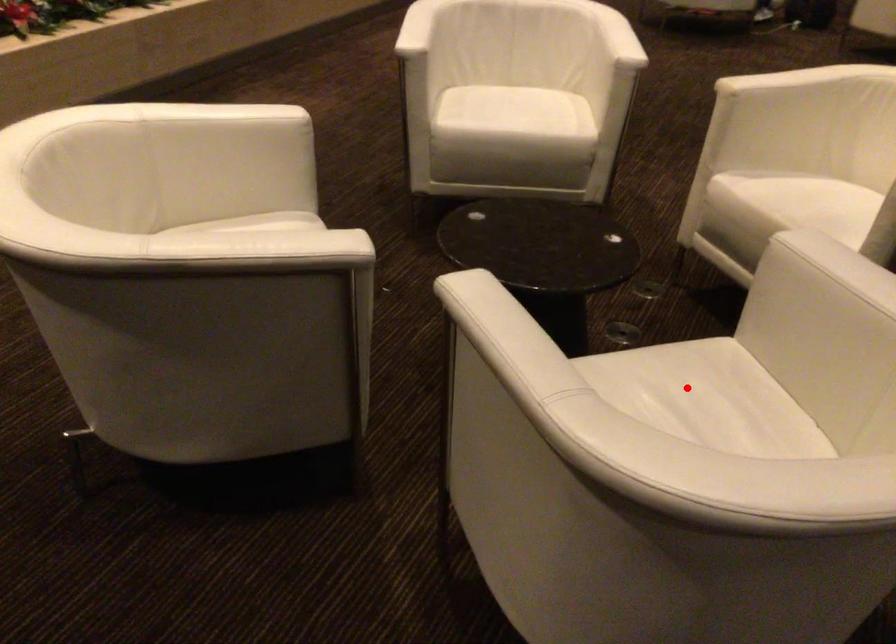
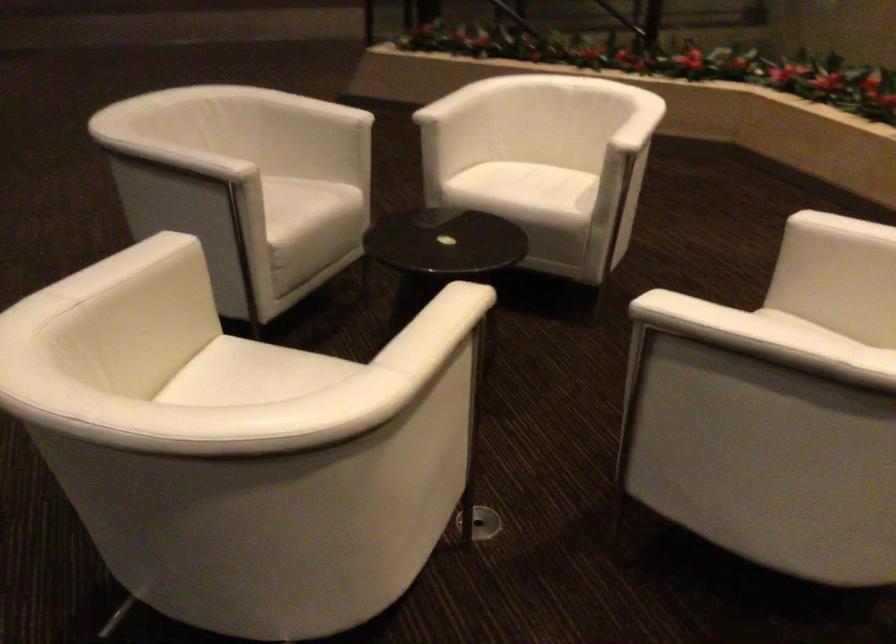
Question: I am providing you with two images of the same scene from different viewpoints. A red point is marked on the first image. At the location where the point appears in image 1, is it still visible in image 2?

Choices:
 (A) Yes
 (B) No

Answer: (B)